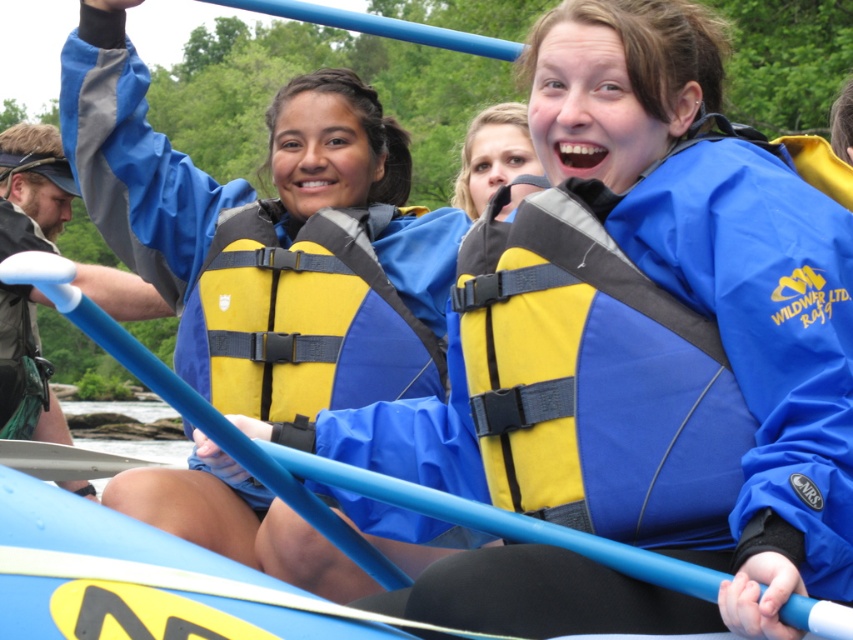
Question: Can you confirm if yellow fabric life jacket at upper center is thinner than metallic blue paddle at center?

Choices:
 (A) yes
 (B) no

Answer: (A)

Question: Which object appears farthest from the camera in this image?

Choices:
 (A) metallic blue paddle at center
 (B) yellow/padded life jacket at center
 (C) yellow fabric life vest at upper center

Answer: (C)

Question: Can you confirm if yellow fabric life jacket at upper center is wider than metallic blue paddle at center?

Choices:
 (A) yes
 (B) no

Answer: (B)

Question: Which object is farther from the camera taking this photo?

Choices:
 (A) yellow fabric life jacket at upper center
 (B) matte blue life vest at upper center
 (C) yellow/padded life jacket at center
 (D) metallic blue paddle at center

Answer: (D)

Question: Does matte blue life vest at upper center lie in front of metallic blue paddle at center?

Choices:
 (A) no
 (B) yes

Answer: (B)

Question: Considering the real-world distances, which object is farthest from the yellow fabric life vest at upper center?

Choices:
 (A) yellow fabric life jacket at upper center
 (B) metallic blue paddle at center
 (C) yellow/padded life jacket at center

Answer: (A)